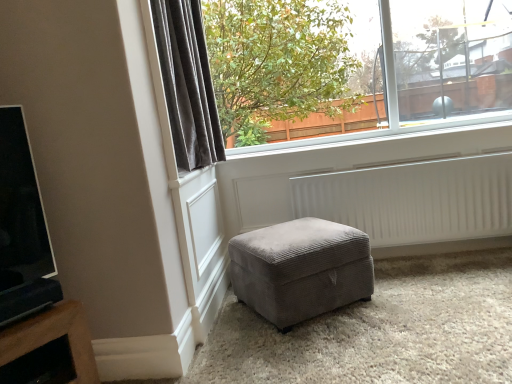
Describe the element at coordinates (432, 60) in the screenshot. I see `clear glass window at upper center` at that location.

What do you see at coordinates (301, 269) in the screenshot?
I see `velvet grey ottoman at center` at bounding box center [301, 269].

You are a GUI agent. You are given a task and a screenshot of the screen. Output one action in this format:
    pyautogui.click(x=<x>, y=<y>)
    Task: Click on the white ribbed radiator at lower center
    This screenshot has height=384, width=512.
    Given the screenshot: What is the action you would take?
    pyautogui.click(x=414, y=199)

Based on their positions, is clear glass window at upper center located to the left or right of velvet grey ottoman at center?

From the image, it's evident that clear glass window at upper center is to the right of velvet grey ottoman at center.

Is point (509, 1) positioned before point (296, 250)?

No.

In the image, is clear glass window at upper center positioned in front of or behind velvet grey ottoman at center?

Clearly, clear glass window at upper center is behind velvet grey ottoman at center.

Is clear glass window at upper center bigger than velvet grey ottoman at center?

Correct, clear glass window at upper center is larger in size than velvet grey ottoman at center.

From their relative heights in the image, would you say white ribbed radiator at lower center is taller or shorter than velvet gray curtain at upper left?

Clearly, white ribbed radiator at lower center is shorter compared to velvet gray curtain at upper left.

From a real-world perspective, which is physically below, white ribbed radiator at lower center or velvet gray curtain at upper left?

white ribbed radiator at lower center is physically lower.

This screenshot has width=512, height=384. I want to click on curtain in front of the white ribbed radiator at lower center, so click(x=187, y=83).

Is white ribbed radiator at lower center oriented towards velvet gray curtain at upper left?

No, white ribbed radiator at lower center is not turned towards velvet gray curtain at upper left.

Could you tell me if white ribbed radiator at lower center is turned towards clear glass window at upper center?

No, white ribbed radiator at lower center is not turned towards clear glass window at upper center.

Does white ribbed radiator at lower center touch clear glass window at upper center?

white ribbed radiator at lower center and clear glass window at upper center are not in contact.

Who is shorter, white ribbed radiator at lower center or clear glass window at upper center?

Standing shorter between the two is white ribbed radiator at lower center.

How many degrees apart are the facing directions of white ribbed radiator at lower center and clear glass window at upper center?

white ribbed radiator at lower center and clear glass window at upper center are facing 0.094 degrees away from each other.

From a real-world perspective, who is located higher, velvet gray curtain at upper left or white ribbed radiator at lower center?

velvet gray curtain at upper left, from a real-world perspective.

Identify the location of curtain that appears above the white ribbed radiator at lower center (from a real-world perspective). This screenshot has height=384, width=512. (187, 83).

Considering the sizes of objects velvet gray curtain at upper left and white ribbed radiator at lower center in the image provided, who is bigger, velvet gray curtain at upper left or white ribbed radiator at lower center?

velvet gray curtain at upper left.

Is white ribbed radiator at lower center shorter than velvet grey ottoman at center?

No, white ribbed radiator at lower center is not shorter than velvet grey ottoman at center.

Between white ribbed radiator at lower center and velvet grey ottoman at center, which one appears on the right side from the viewer's perspective?

white ribbed radiator at lower center.

Is white ribbed radiator at lower center facing towards velvet grey ottoman at center?

Yes, white ribbed radiator at lower center faces towards velvet grey ottoman at center.

Between white ribbed radiator at lower center and velvet grey ottoman at center, which one has smaller size?

With smaller size is white ribbed radiator at lower center.

From the image's perspective, is velvet grey ottoman at center positioned above or below velvet gray curtain at upper left?

Based on their image positions, velvet grey ottoman at center is located beneath velvet gray curtain at upper left.

Between velvet grey ottoman at center and velvet gray curtain at upper left, which one appears on the right side from the viewer's perspective?

From the viewer's perspective, velvet grey ottoman at center appears more on the right side.

Do you think velvet grey ottoman at center is within velvet gray curtain at upper left, or outside of it?

velvet grey ottoman at center cannot be found inside velvet gray curtain at upper left.

Is there a large distance between velvet grey ottoman at center and velvet gray curtain at upper left?

velvet grey ottoman at center is actually quite close to velvet gray curtain at upper left.

How different are the orientations of velvet gray curtain at upper left and velvet grey ottoman at center in degrees?

55.4 degrees separate the facing orientations of velvet gray curtain at upper left and velvet grey ottoman at center.

You are a GUI agent. You are given a task and a screenshot of the screen. Output one action in this format:
    pyautogui.click(x=<x>, y=<y>)
    Task: Click on the studio couch on the right of the velvet gray curtain at upper left
    
    Given the screenshot: What is the action you would take?
    pyautogui.click(x=301, y=269)

Which of these two, velvet gray curtain at upper left or velvet grey ottoman at center, is thinner?

With smaller width is velvet gray curtain at upper left.

From the image's perspective, relative to velvet grey ottoman at center, is velvet gray curtain at upper left above or below?

Based on their image positions, velvet gray curtain at upper left is located above velvet grey ottoman at center.

Image resolution: width=512 pixels, height=384 pixels. I want to click on studio couch in front of the clear glass window at upper center, so click(301, 269).

Where is `curtain located above the white ribbed radiator at lower center (from a real-world perspective)`? Image resolution: width=512 pixels, height=384 pixels. curtain located above the white ribbed radiator at lower center (from a real-world perspective) is located at coordinates (187, 83).

Looking at the image, which one is located closer to velvet gray curtain at upper left, clear glass window at upper center or white ribbed radiator at lower center?

white ribbed radiator at lower center lies closer to velvet gray curtain at upper left than the other object.

From the image, which object appears to be farther from velvet grey ottoman at center, clear glass window at upper center or white ribbed radiator at lower center?

clear glass window at upper center lies further to velvet grey ottoman at center than the other object.

Estimate the real-world distances between objects in this image. Which object is closer to velvet gray curtain at upper left, clear glass window at upper center or velvet grey ottoman at center?

Among the two, velvet grey ottoman at center is located nearer to velvet gray curtain at upper left.

Estimate the real-world distances between objects in this image. Which object is further from clear glass window at upper center, white ribbed radiator at lower center or velvet gray curtain at upper left?

Based on the image, velvet gray curtain at upper left appears to be further to clear glass window at upper center.

Considering their positions, is velvet gray curtain at upper left positioned closer to white ribbed radiator at lower center than velvet grey ottoman at center?

Based on the image, velvet grey ottoman at center appears to be nearer to white ribbed radiator at lower center.

From the image, which object appears to be nearer to clear glass window at upper center, white ribbed radiator at lower center or velvet grey ottoman at center?

white ribbed radiator at lower center is closer to clear glass window at upper center.

When comparing their distances from clear glass window at upper center, does velvet grey ottoman at center or velvet gray curtain at upper left seem further?

Among the two, velvet grey ottoman at center is located further to clear glass window at upper center.

Considering their positions, is velvet grey ottoman at center positioned further to velvet gray curtain at upper left than white ribbed radiator at lower center?

The object further to velvet gray curtain at upper left is white ribbed radiator at lower center.

Find the location of a particular element. The image size is (512, 384). radiator between clear glass window at upper center and velvet grey ottoman at center in the vertical direction is located at coordinates (414, 199).

Locate an element on the screen. curtain between clear glass window at upper center and velvet grey ottoman at center from top to bottom is located at coordinates (187, 83).

Find the location of a particular element. window between velvet gray curtain at upper left and white ribbed radiator at lower center is located at coordinates (432, 60).

Locate an element on the screen. studio couch between velvet gray curtain at upper left and white ribbed radiator at lower center from left to right is located at coordinates (301, 269).